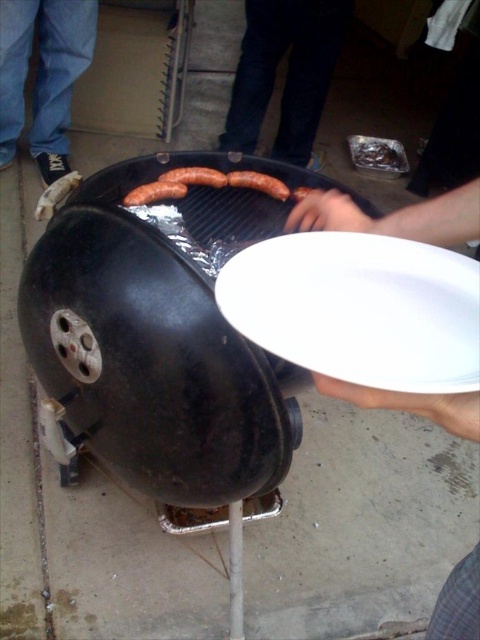
From the picture: Is brown matte sausage at center smaller than sausage at center?

Actually, brown matte sausage at center might be larger than sausage at center.

This screenshot has height=640, width=480. What do you see at coordinates (194, 177) in the screenshot? I see `brown matte sausage at center` at bounding box center [194, 177].

Is point (201, 179) positioned in front of point (299, 196)?

Yes, point (201, 179) is in front of point (299, 196).

Identify the location of brown matte sausage at center. Image resolution: width=480 pixels, height=640 pixels. (194, 177).

Based on the photo, which of these two, white matte plate at center or shiny aluminum foil at upper right, stands shorter?

With less height is white matte plate at center.

Who is more distant from viewer, (419,227) or (372,157)?

Point (372,157)

Who is more distant from viewer, (478, 403) or (376, 163)?

The point (376, 163) is more distant.

This screenshot has width=480, height=640. Identify the location of white matte plate at center. (396, 216).

Based on the photo, can you confirm if white plastic plate at center is positioned to the left of brown matte sausages at center?

In fact, white plastic plate at center is to the right of brown matte sausages at center.

Can you confirm if white plastic plate at center is positioned to the right of brown matte sausages at center?

Indeed, white plastic plate at center is positioned on the right side of brown matte sausages at center.

Is point (402, 339) behind point (148, 198)?

No, (402, 339) is in front of (148, 198).

This screenshot has width=480, height=640. I want to click on white plastic plate at center, so click(x=359, y=308).